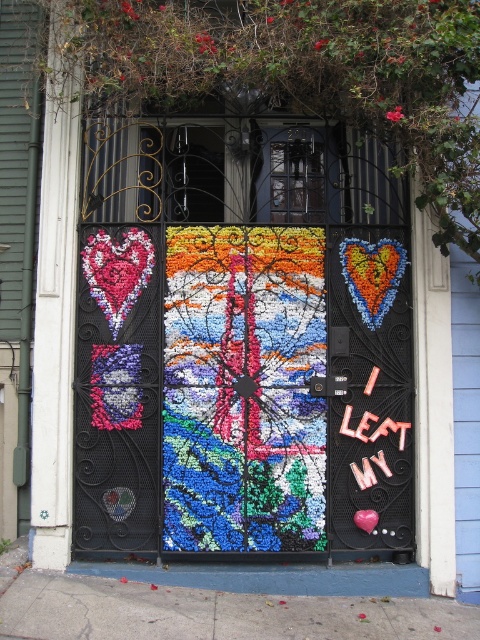
You are a delivery person trying to locate the entrance to the building. The multicolored mosaic door at center and the pink matte heart at center are both visible. Which one should you look above to find the entrance?

The multicolored mosaic door at center is above the pink matte heart at center, so you should look above the pink matte heart at center to find the entrance.

You are a delivery person trying to read the address on the gate. The address is written on the pink plastic letters at center right and the pink matte heart at center. Which object is covering the other, making it harder to see the address?

The pink plastic letters at center right is positioned over the pink matte heart at center, so it is covering the heart and making it harder to see the address.

You are a delivery person trying to deliver a package to the building. The address says to look for the pink plastic letters at center right. However, you see the multicolored mosaic door at center. Which object should you focus on to find the correct entrance?

You should focus on the pink plastic letters at center right because the multicolored mosaic door at center is larger and might be a decorative element, while the pink plastic letters at center right are smaller and likely indicate the entrance.